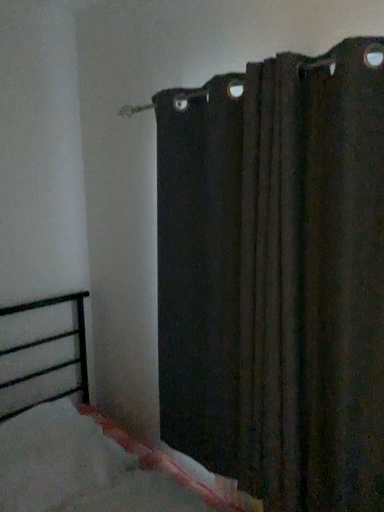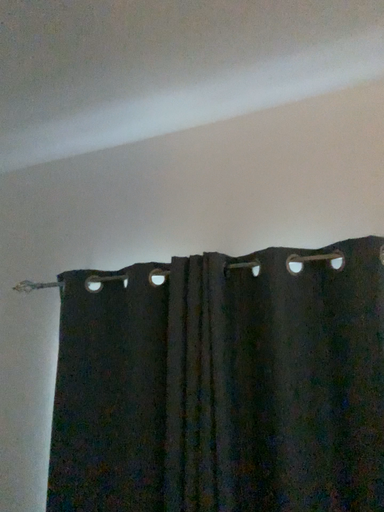
Question: Which way did the camera rotate in the video?

Choices:
 (A) rotated right
 (B) rotated left

Answer: (A)